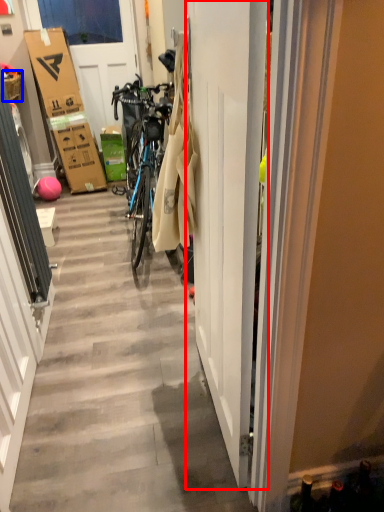
Question: Which object appears farthest to the camera in this image, door (highlighted by a red box) or picnic basket (highlighted by a blue box)?

Choices:
 (A) door
 (B) picnic basket

Answer: (B)